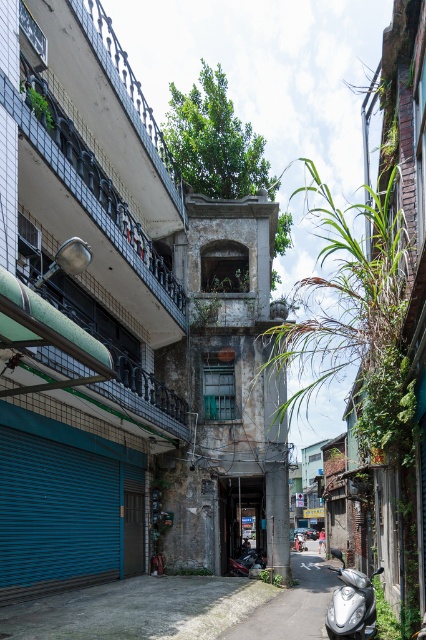
You are a delivery person trying to park your silver metallic scooter at lower right near the blue metallic garage door at lower left. Based on the scene, can you safely park the scooter to the immediate left of the garage door without blocking the alleyway?

The blue metallic garage door at lower left is positioned on the left side of silver metallic scooter at lower right, so parking the scooter to the immediate left of the garage door would place it further left than the door, potentially blocking the alleyway. Choose another spot.

You are a delivery person trying to navigate through the alleyway. You need to pass by both the blue metallic garage door at lower left and the silver metallic scooter at lower right. Given their sizes, which object might require more careful maneuvering around?

Result: The silver metallic scooter at lower right requires more careful maneuvering because it is larger in size compared to the blue metallic garage door at lower left.

You are standing in the alleyway and want to reach the point marked at coordinates (20, 592). If your current position is 10 meters away from that point, how much further do you need to walk to reach it?

The point at coordinates (20, 592) is 11.20 meters from the viewer. Since you are currently 10 meters away, you need to walk an additional 1.20 meters to reach it.